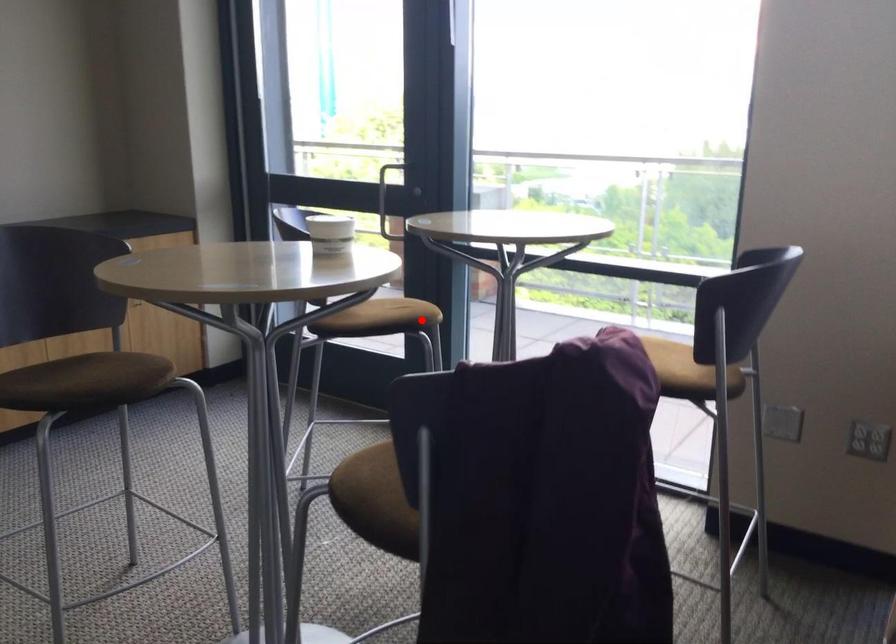
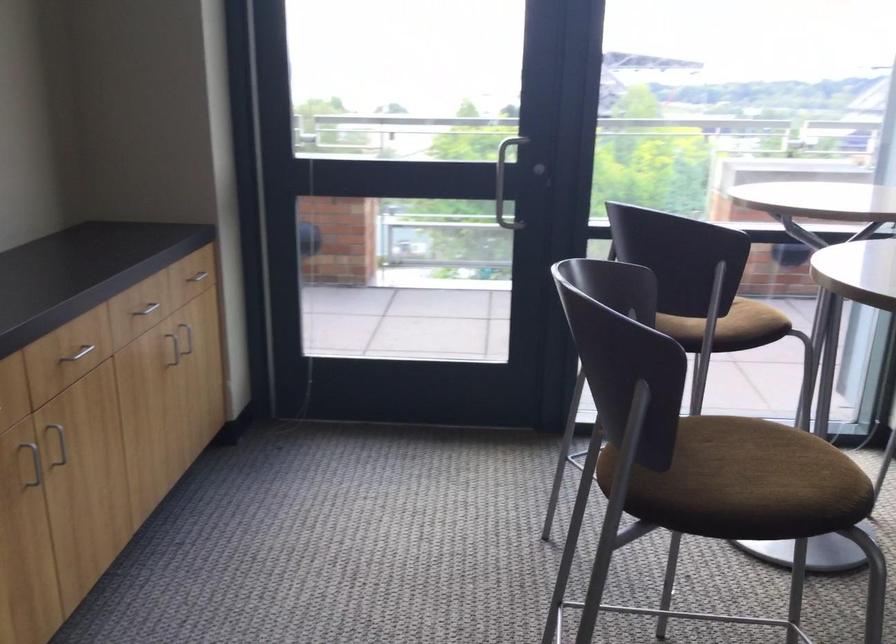
Question: I am providing you with two images of the same scene from different viewpoints. A red point is shown in image1. For the corresponding object point in image2, is it positioned nearer or farther from the camera?

Choices:
 (A) Nearer
 (B) Farther

Answer: (A)